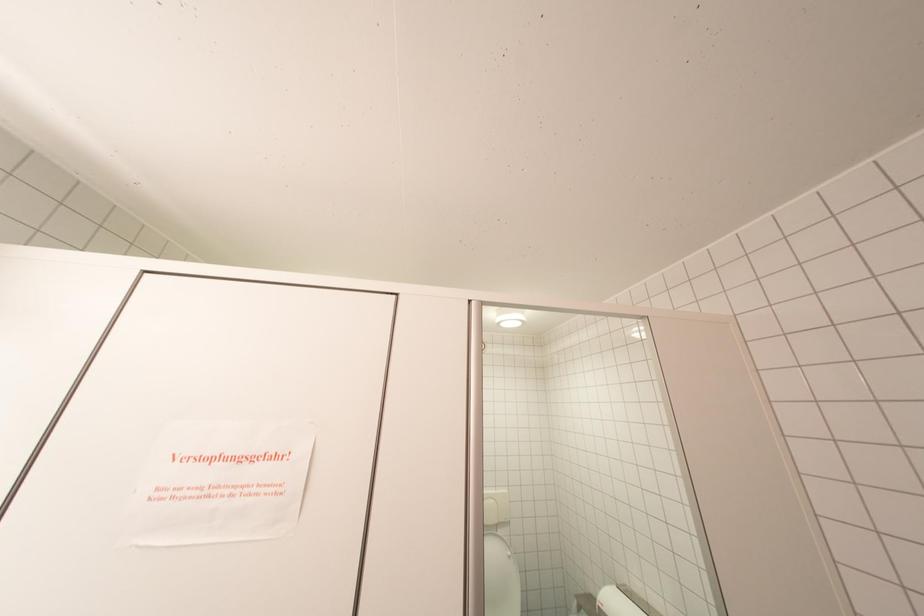
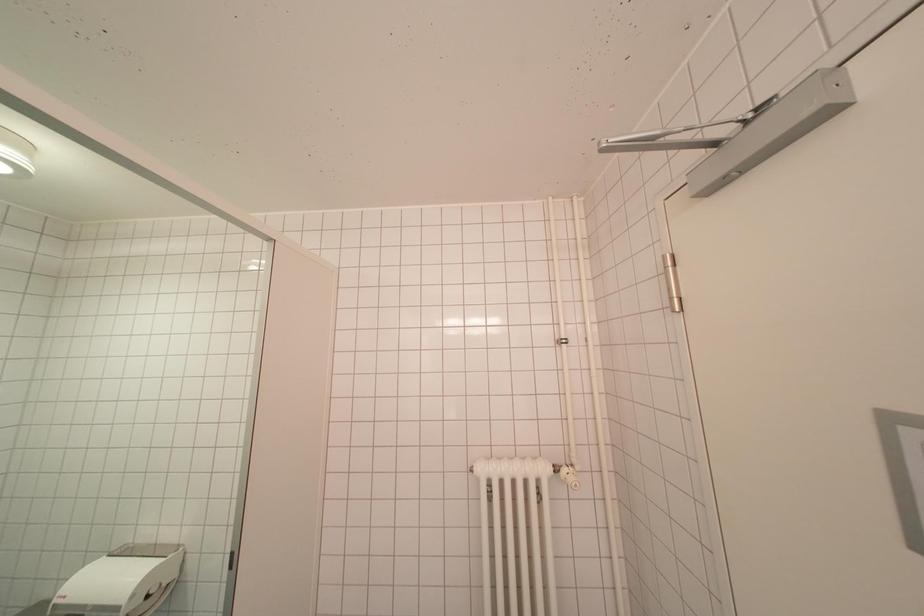
Question: Based on the continuous images, in which direction is the camera rotating? Reply with the corresponding letter.

Choices:
 (A) Left
 (B) Right
 (C) Up
 (D) Down

Answer: (B)